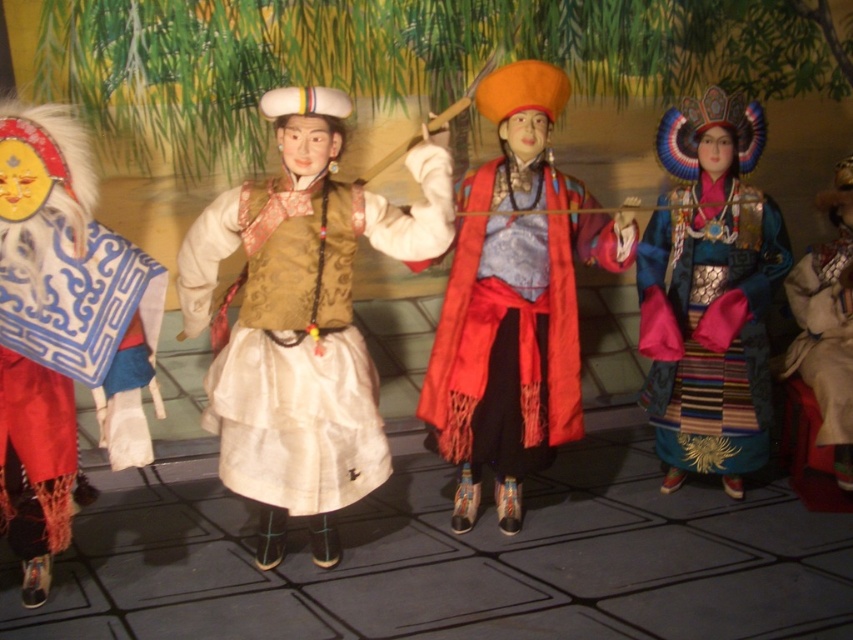
Who is taller, silky red robe at center or matte blue fabric mask at left?

Standing taller between the two is silky red robe at center.

Is silky red robe at center thinner than matte blue fabric mask at left?

No.

Identify the location of silky red robe at center. The height and width of the screenshot is (640, 853). (514, 301).

Find the location of a particular element. silky red robe at center is located at coordinates (514, 301).

Does point (517, 308) come farther from viewer compared to point (830, 348)?

No, it is not.

The height and width of the screenshot is (640, 853). I want to click on silky red robe at center, so click(514, 301).

Can you confirm if satin beige vest at center is smaller than matte blue fabric mask at left?

Actually, satin beige vest at center might be larger than matte blue fabric mask at left.

What are the coordinates of `satin beige vest at center` in the screenshot? It's located at (302, 320).